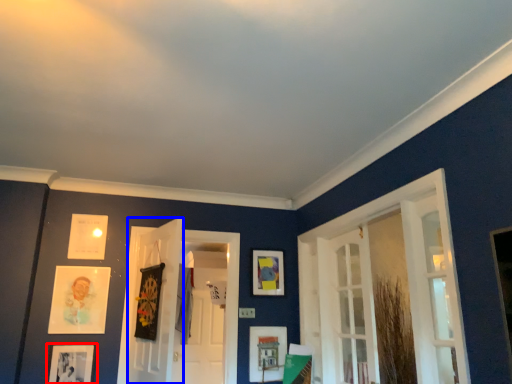
Question: Which object is closer to the camera taking this photo, picture frame (highlighted by a red box) or door (highlighted by a blue box)?

Choices:
 (A) picture frame
 (B) door

Answer: (B)